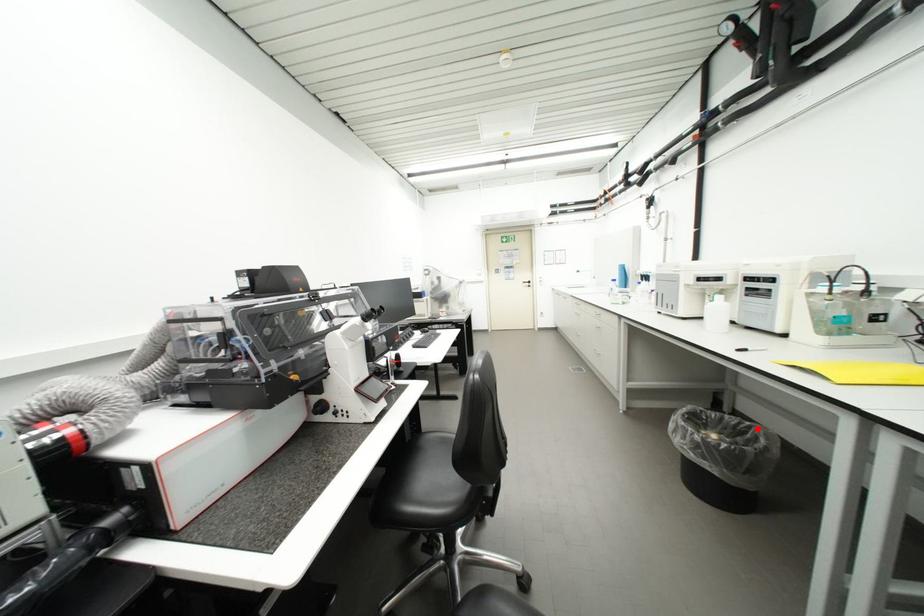
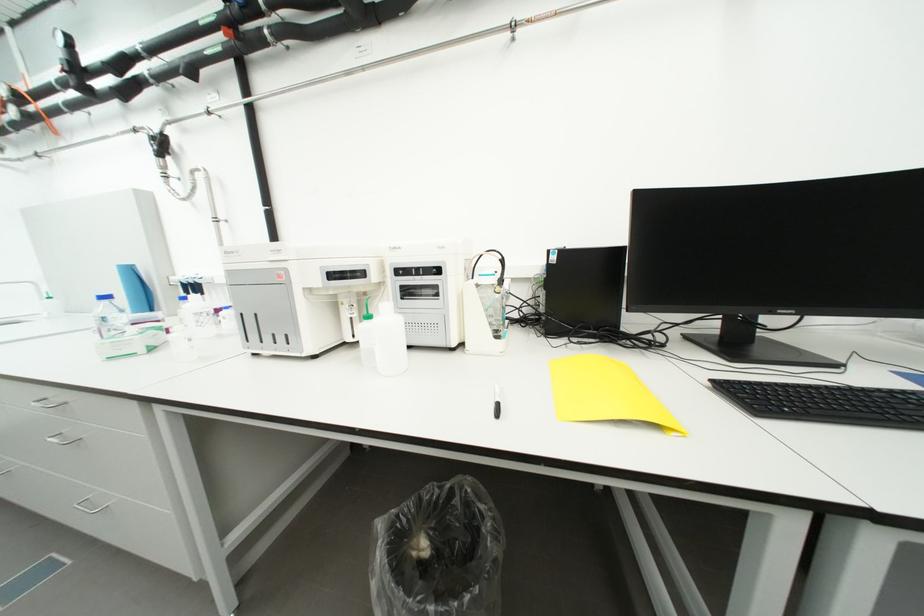
The point at the highlighted location is marked in the first image. Where is the corresponding point in the second image?

(459, 493)